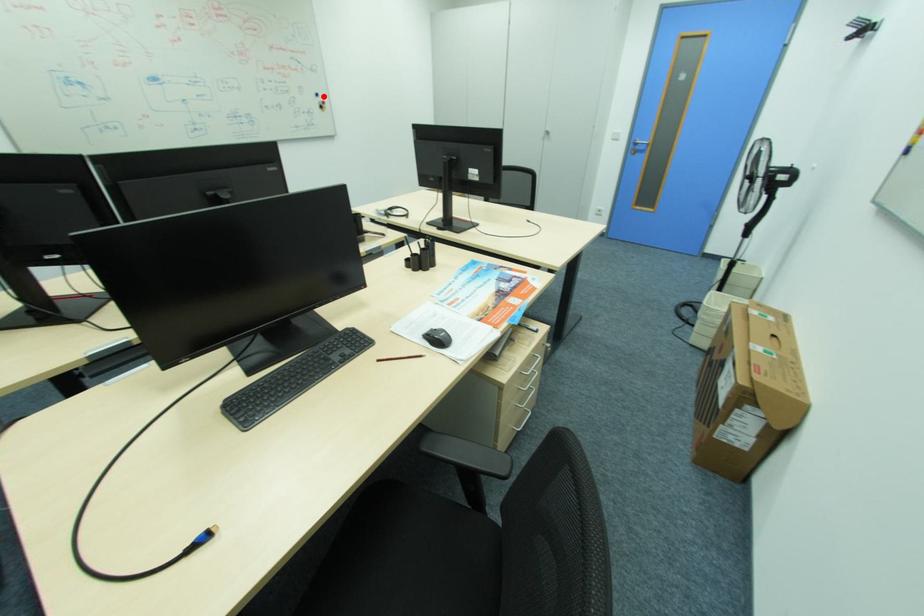
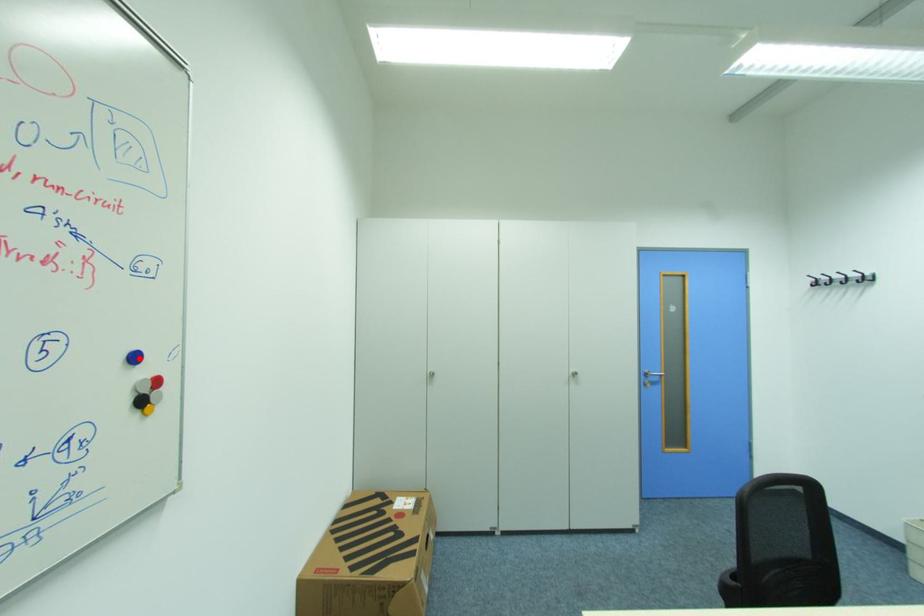
I am providing you with two images of the same scene from different viewpoints. A red point is marked on the first image and another point is marked on the second image. Is the marked point in image1 the same physical position as the marked point in image2?

Yes